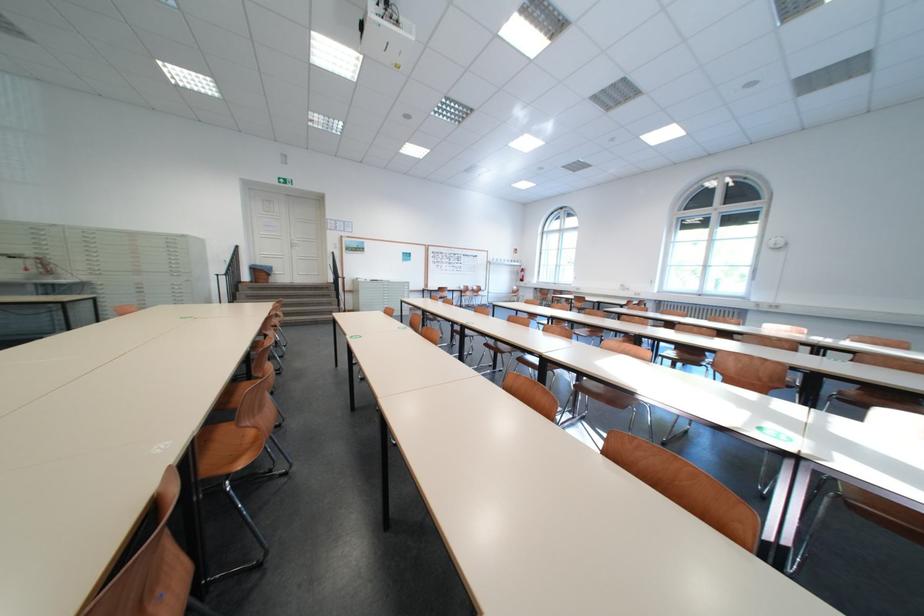
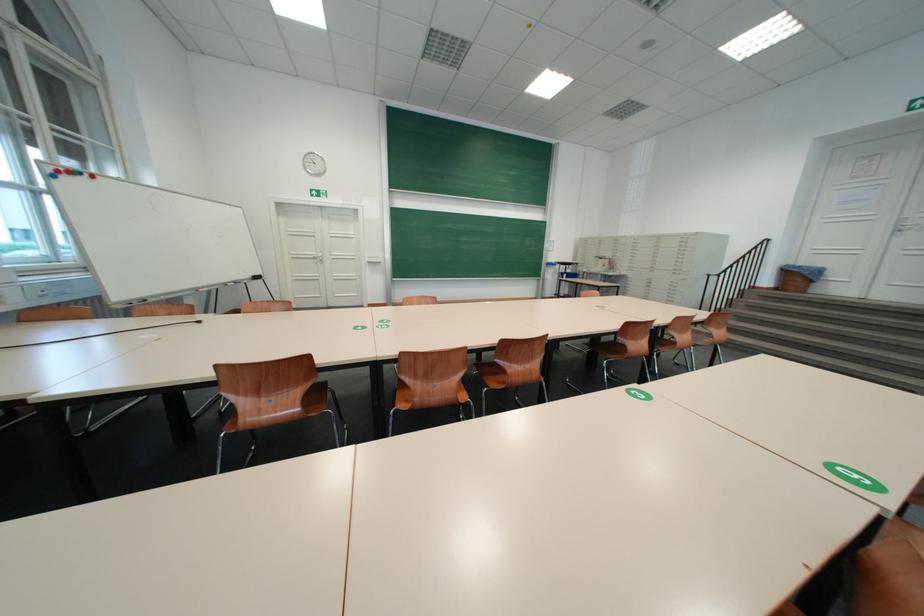
Find the pixel in the second image that matches (261,278) in the first image.

(781, 283)